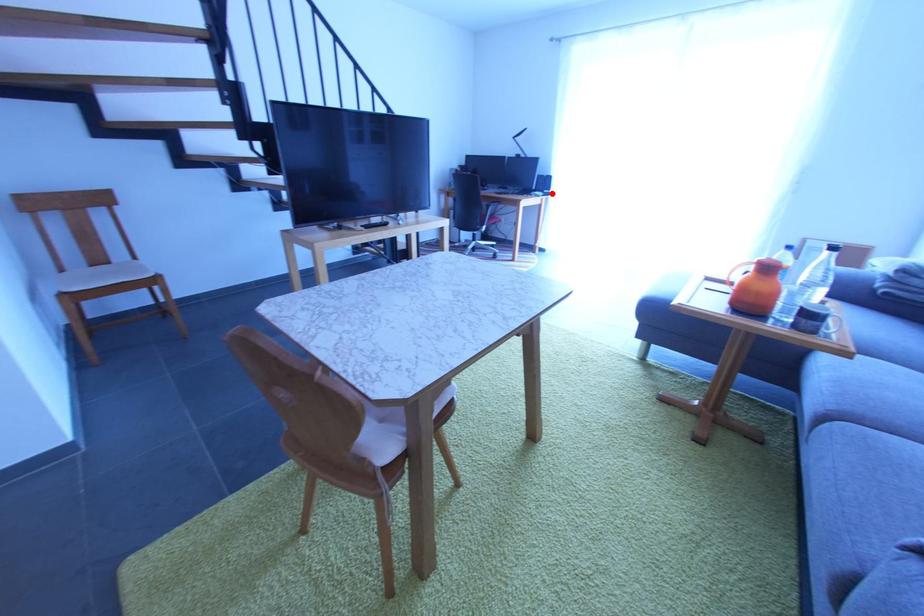
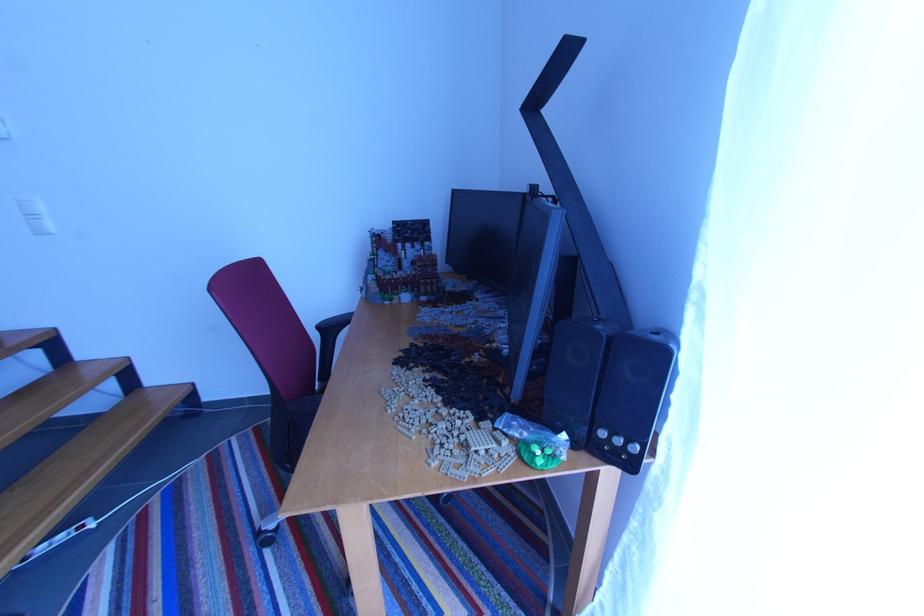
Find the pixel in the second image that matches the highlighted location in the first image.

(623, 443)